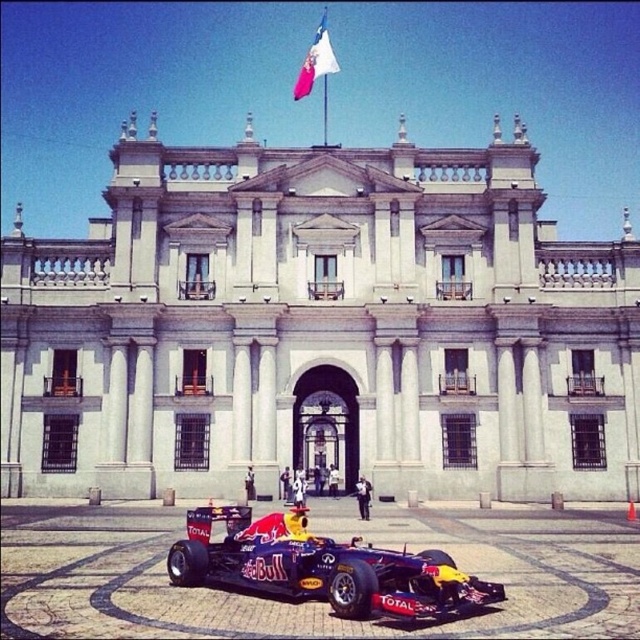
Question: Which of the following is the closest to the observer?

Choices:
 (A) shiny red racing car at center
 (B) white stone building at center

Answer: (A)

Question: Which object is positioned closest to the white fabric flag at upper center?

Choices:
 (A) white stone building at center
 (B) shiny red racing car at center

Answer: (A)

Question: Does white stone building at center appear on the left side of shiny red racing car at center?

Choices:
 (A) yes
 (B) no

Answer: (A)

Question: Which object is positioned closest to the white fabric flag at upper center?

Choices:
 (A) white stone building at center
 (B) shiny red racing car at center

Answer: (A)

Question: Is shiny red racing car at center smaller than white fabric flag at upper center?

Choices:
 (A) yes
 (B) no

Answer: (B)

Question: Does white stone building at center appear on the right side of white fabric flag at upper center?

Choices:
 (A) no
 (B) yes

Answer: (A)